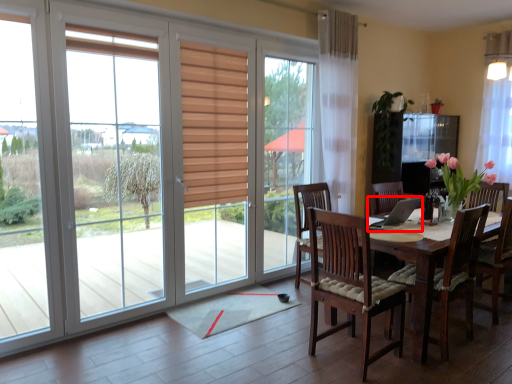
Question: From the image's perspective, considering the relative positions of laptop (annotated by the red box) and curtain in the image provided, where is laptop (annotated by the red box) located with respect to the staircase?

Choices:
 (A) above
 (B) below

Answer: (B)